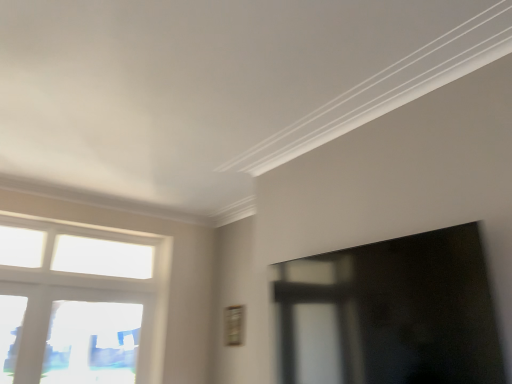
Question: In terms of height, does transparent glass window screen at right look taller or shorter compared to white glass window at left, which appears as the second window when ordered from the bottom?

Choices:
 (A) tall
 (B) short

Answer: (B)

Question: Is transparent glass window screen at right inside the boundaries of white glass window at left, which appears as the second window when ordered from the bottom, or outside?

Choices:
 (A) inside
 (B) outside

Answer: (B)

Question: Which is nearer to the transparent glass window at lower left, acting as the first window starting from the bottom?

Choices:
 (A) white glass window at left, arranged as the first window when viewed from the top
 (B) transparent glass window screen at right

Answer: (A)

Question: Which object is the farthest from the white glass window at left, arranged as the first window when viewed from the top?

Choices:
 (A) transparent glass window at lower left, placed as the 2th window when sorted from top to bottom
 (B) transparent glass window screen at right

Answer: (B)